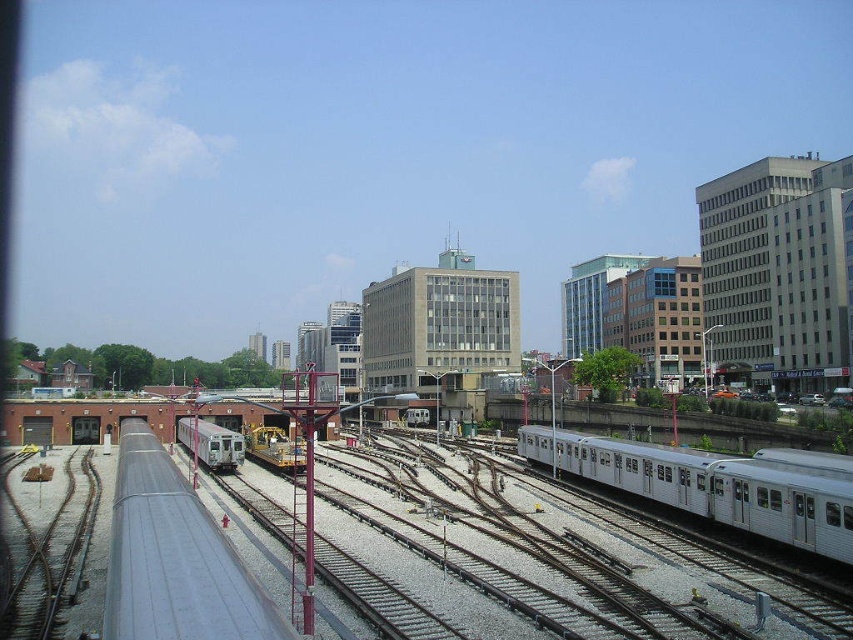
Question: Which is farther from the silver metallic train at right?

Choices:
 (A) gray metallic track at lower left
 (B) silver metallic train at lower left

Answer: (B)

Question: Which is nearer to the silver metallic train at right?

Choices:
 (A) gray metallic track at lower left
 (B) silver metallic train at lower left

Answer: (A)

Question: Does silver metallic train at right come in front of gray metallic track at lower left?

Choices:
 (A) no
 (B) yes

Answer: (A)

Question: Which point is closer to the camera?

Choices:
 (A) (750, 480)
 (B) (206, 444)

Answer: (A)

Question: Is silver metallic train at right to the right of gray metallic track at lower left from the viewer's perspective?

Choices:
 (A) no
 (B) yes

Answer: (B)

Question: Is silver metallic train at right further to the viewer compared to gray metallic track at lower left?

Choices:
 (A) no
 (B) yes

Answer: (B)